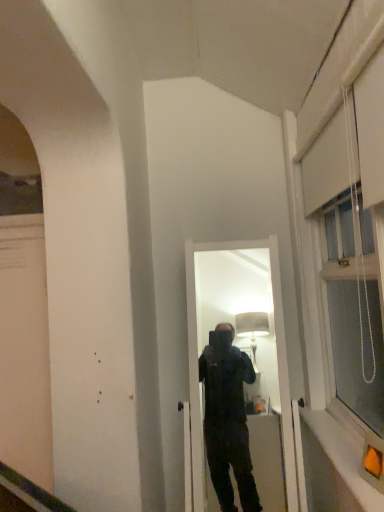
Where is `transparent plastic screen door at center`? The image size is (384, 512). transparent plastic screen door at center is located at coordinates (238, 350).

This screenshot has width=384, height=512. Describe the element at coordinates (238, 350) in the screenshot. I see `transparent plastic screen door at center` at that location.

The width and height of the screenshot is (384, 512). I want to click on transparent plastic screen door at center, so pyautogui.click(x=238, y=350).